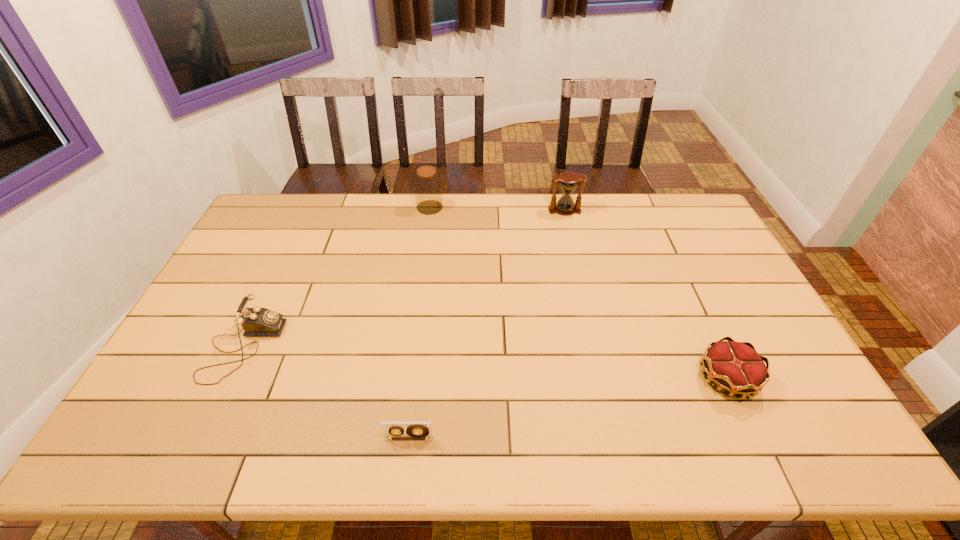
Find the location of a particular element. The image size is (960, 540). blank space at the far right corner of the desktop is located at coordinates (666, 211).

Where is `vacant region between the shortest object and the telephone`? vacant region between the shortest object and the telephone is located at coordinates (325, 393).

Find the location of a particular element. The height and width of the screenshot is (540, 960). free spot between the hourglass and the leftmost object is located at coordinates (403, 279).

The width and height of the screenshot is (960, 540). I want to click on free point between the shortest object and the leftmost object, so click(325, 393).

Image resolution: width=960 pixels, height=540 pixels. Find the location of `vacant area that lies between the hourglass and the shortest object`. vacant area that lies between the hourglass and the shortest object is located at coordinates (487, 325).

The width and height of the screenshot is (960, 540). In order to click on vacant point located between the jar and the rightmost object in this screenshot , I will do `click(578, 293)`.

You are a GUI agent. You are given a task and a screenshot of the screen. Output one action in this format:
    pyautogui.click(x=<x>, y=<y>)
    Task: Click on the free space between the fourth object from left to right and the leftmost object
    The image size is (960, 540).
    Given the screenshot: What is the action you would take?
    pyautogui.click(x=403, y=279)

Where is `vacant space that's between the hourglass and the videotape`? This screenshot has height=540, width=960. vacant space that's between the hourglass and the videotape is located at coordinates (487, 325).

This screenshot has height=540, width=960. In order to click on free point between the jar and the third shortest object in this screenshot , I will do `click(336, 278)`.

At what (x,y) coordinates should I click in order to perform the action: click on free space between the nearest object and the crown. Please return your answer as a coordinate pair (x, y). The width and height of the screenshot is (960, 540). Looking at the image, I should click on (568, 408).